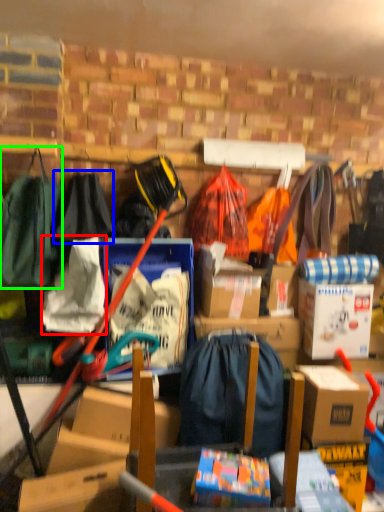
Question: Which is farther away from clothing (highlighted by a red box)? clothing (highlighted by a blue box) or clothing (highlighted by a green box)?

Choices:
 (A) clothing
 (B) clothing

Answer: (A)